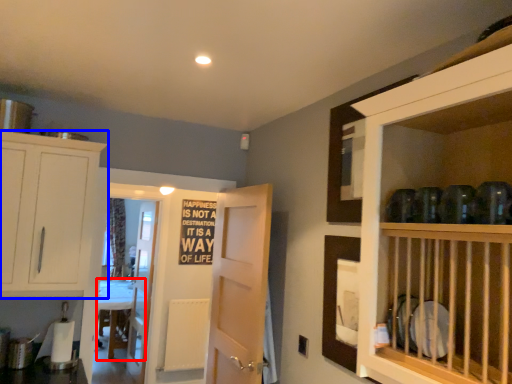
Question: Among these objects, which one is farthest to the camera, counter (highlighted by a red box) or cabinetry (highlighted by a blue box)?

Choices:
 (A) counter
 (B) cabinetry

Answer: (A)